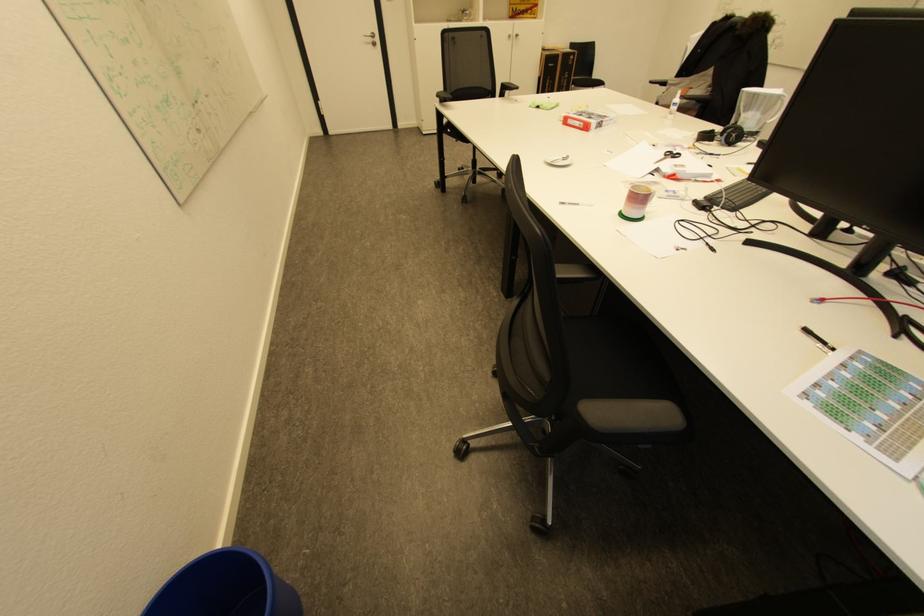
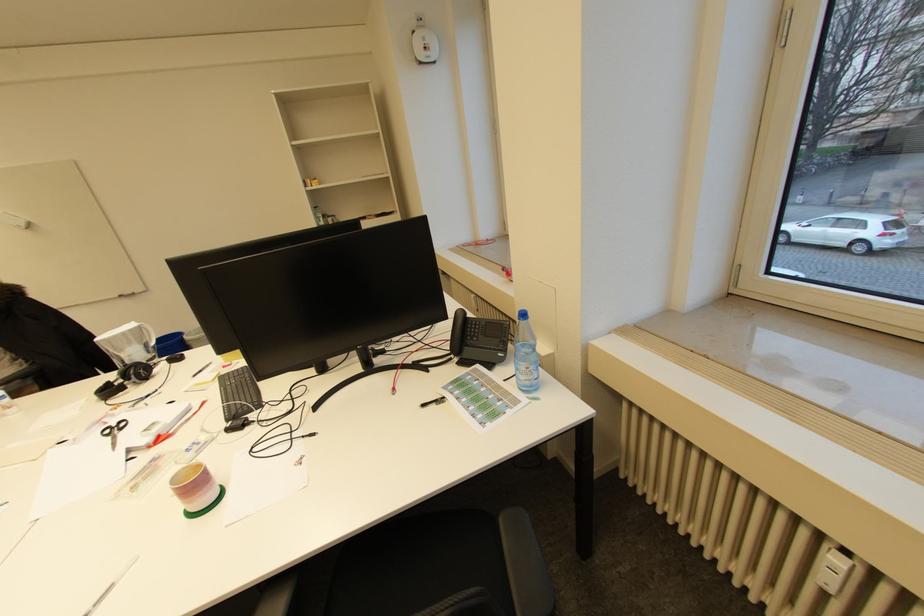
Find the pixel in the second image that matches (x=831, y=344) in the first image.

(442, 400)